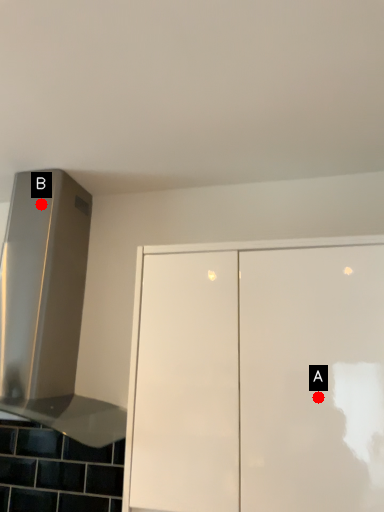
Question: Two points are circled on the image, labeled by A and B beside each circle. Which point appears farthest from the camera in this image?

Choices:
 (A) A is further
 (B) B is further

Answer: (B)